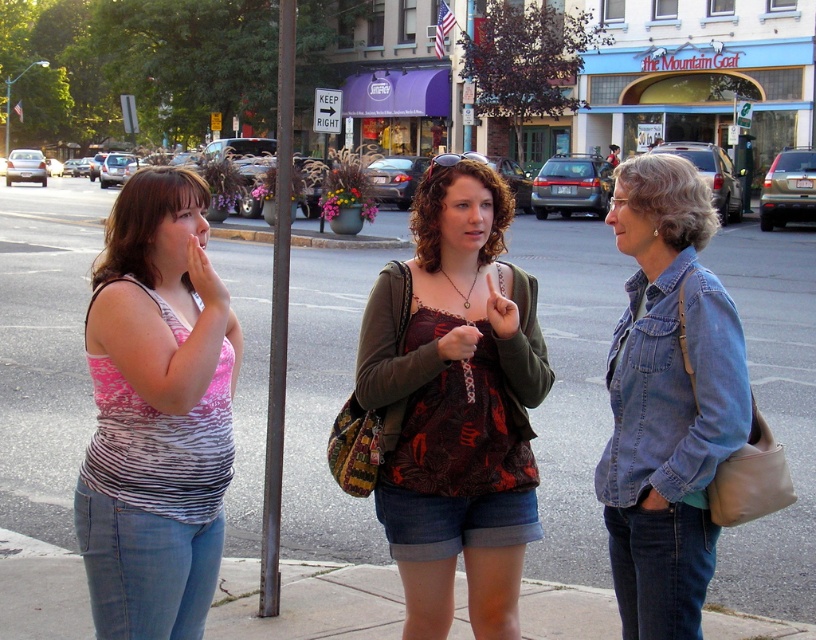
You are a photographer trying to capture a photo of the pink striped tank top at left and the dark gray metal pole at center. Based on their heights, which object should you focus on first if you want to ensure both are in frame without needing to adjust your camera angle?

The pink striped tank top at left has a lesser height compared to the dark gray metal pole at center. Therefore, you should focus on the dark gray metal pole at center first to ensure it fits within the frame, as it is taller and might require more adjustment to include its full height.

You are a street artist planning to paint a mural on the dark gray metal pole at center. The pink striped tank top at left is 15 cm wide. If the pole is twice as wide as the tank top, what is the minimum width of your painting canvas required to cover the entire pole?

The dark gray metal pole at center is twice as wide as the pink striped tank top at left, which is 15 cm. Therefore, the pole is 30 cm wide. The minimum canvas width needed is 30 cm to cover the entire pole.